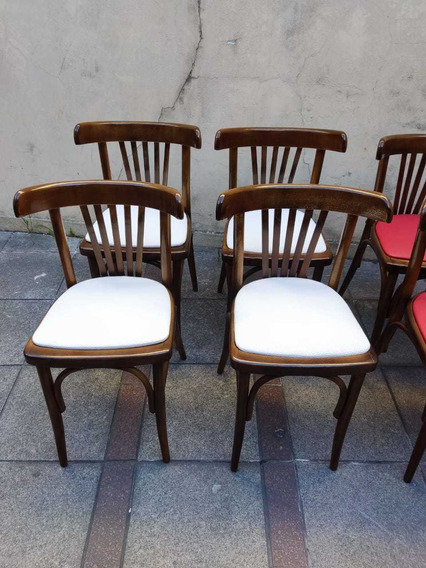
At what (x,y) coordinates should I click in order to perform the action: click on chairs. Please return your answer as a coordinate pair (x, y). The image size is (426, 568). Looking at the image, I should click on (423, 324), (395, 238), (297, 337), (276, 137), (134, 131), (106, 193).